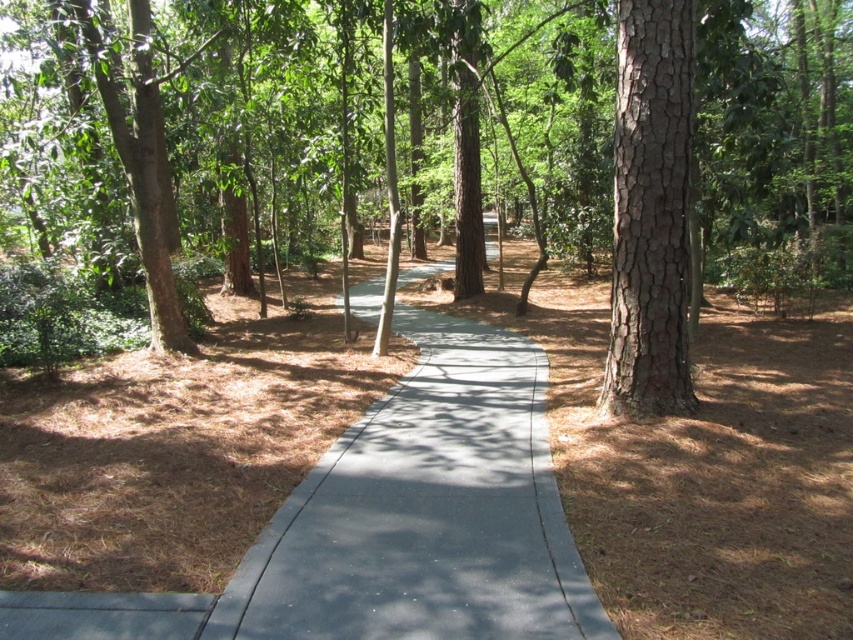
You are standing at the point marked as point (x=425, y=513) in the forest scene. What type of surface are you currently standing on?

You are standing on the gray concrete trail at center located at point (x=425, y=513).

You are a hiker carrying a 1.2 meter wide camping tent. You need to walk along the gray concrete trail at center while avoiding the brown rough bark tree at right. Can your tent fit on the trail without touching the tree?

The gray concrete trail at center is wider than the brown rough bark tree at right, so the 1.2 meter wide camping tent can fit on the trail without touching the tree.